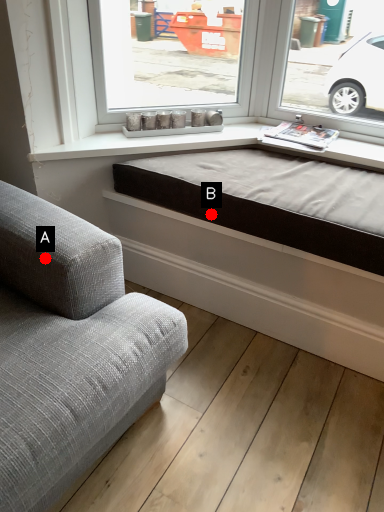
Question: Two points are circled on the image, labeled by A and B beside each circle. Which point is closer to the camera?

Choices:
 (A) A is closer
 (B) B is closer

Answer: (A)